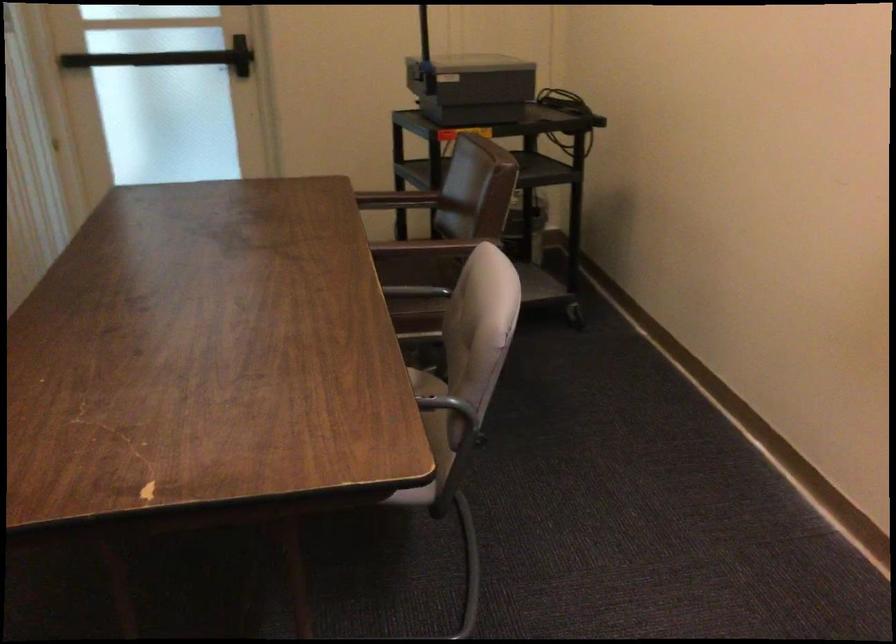
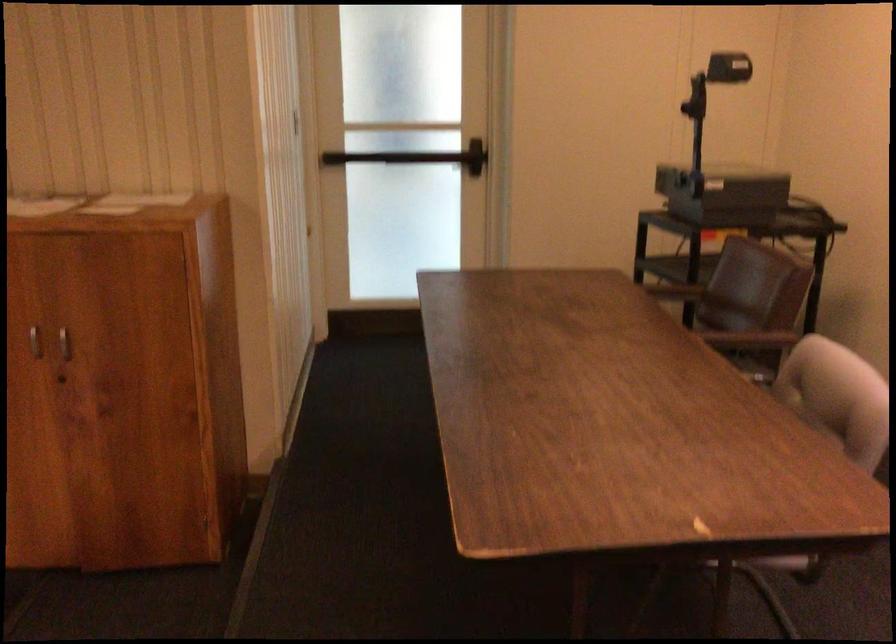
In a continuous first-person perspective shot, in which direction is the camera moving?

The cameraman walked toward left, backward.